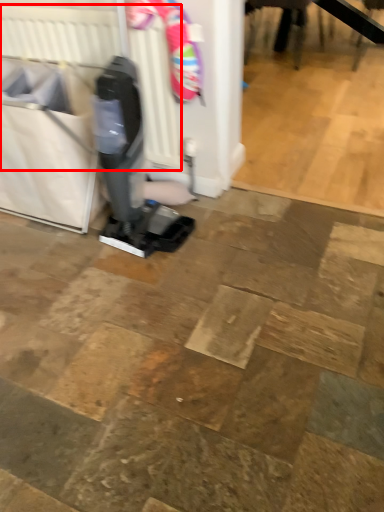
Question: In this image, where is radiator (annotated by the red box) located relative to laundry basket?

Choices:
 (A) left
 (B) right

Answer: (B)